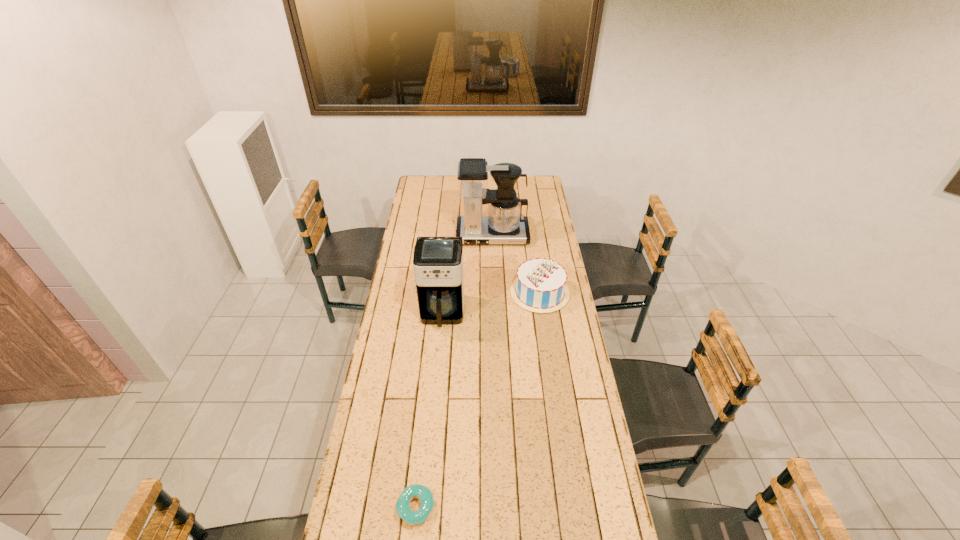
The height and width of the screenshot is (540, 960). I want to click on coffee maker at the left edge, so click(438, 261).

Locate an element on the screen. This screenshot has width=960, height=540. doughnut located in the left edge section of the desktop is located at coordinates (421, 492).

The width and height of the screenshot is (960, 540). Identify the location of coffee maker that is at the right edge. (504, 224).

Find the location of a particular element. birthday cake that is at the right edge is located at coordinates (540, 286).

Locate an element on the screen. The image size is (960, 540). free region at the far edge is located at coordinates (518, 182).

The width and height of the screenshot is (960, 540). I want to click on free space at the left edge of the desktop, so click(414, 248).

Image resolution: width=960 pixels, height=540 pixels. Identify the location of vacant space at the right edge of the desktop. (542, 329).

Where is `empty location between the shorter coffee maker and the third tallest object`? empty location between the shorter coffee maker and the third tallest object is located at coordinates (492, 303).

Find the location of `free space between the nearer coffee maker and the farther coffee maker`. free space between the nearer coffee maker and the farther coffee maker is located at coordinates tap(468, 275).

Find the location of `empty space between the nearer coffee maker and the birthday cake`. empty space between the nearer coffee maker and the birthday cake is located at coordinates pos(492,303).